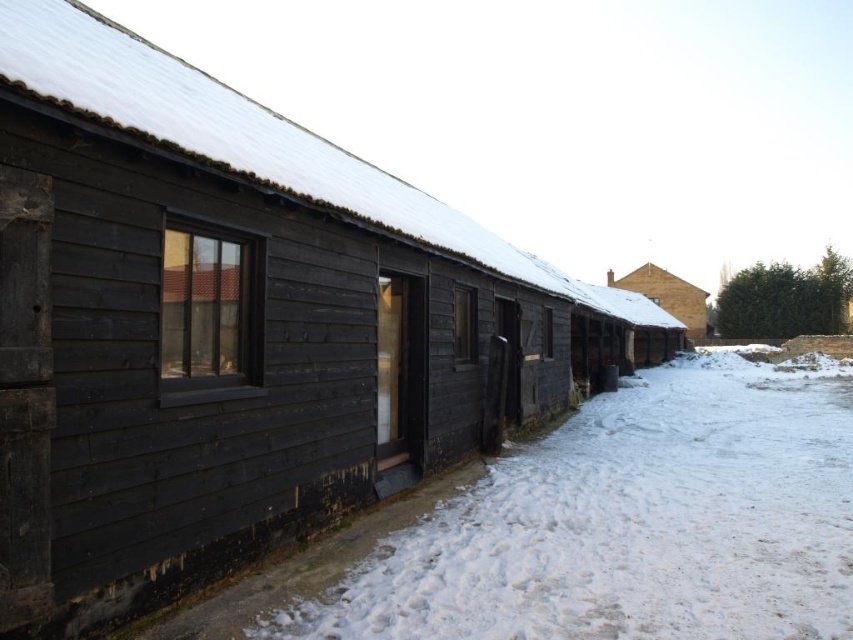
Based on the photo, you are standing in front of the building and want to walk towards the brown textured brick hut at center. Which direction should you move to get closer to it without stepping on the white powdery snow at lower center?

You should move away from the white powdery snow at lower center since it is closer to you than the brown textured brick hut at center. Moving sideways or backward might help avoid stepping on the snow while approaching the hut.

You are standing in front of the building and notice the white powdery snow at lower center and the brown textured brick hut at center. Which one has a higher elevation?

The brown textured brick hut at center has a higher elevation than the white powdery snow at lower center because the snow is lower in height compared to the hut.